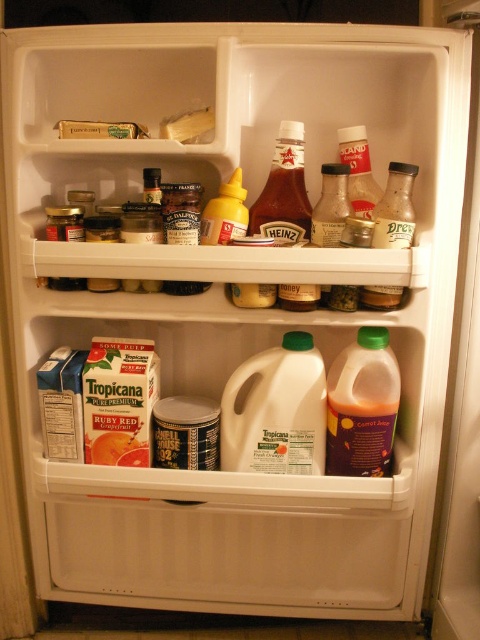
Question: From the image, what is the correct spatial relationship of white plastic jug at center in relation to translucent plastic dressing bottle at upper right?

Choices:
 (A) below
 (B) above

Answer: (A)

Question: Is translucent plastic carrot juice at lower center wider than yellow glossy mustard at upper center?

Choices:
 (A) no
 (B) yes

Answer: (B)

Question: Which object appears farthest from the camera in this image?

Choices:
 (A) white plastic jug at center
 (B) translucent plastic carrot juice at lower center

Answer: (A)

Question: Can you confirm if white plastic jug at center is wider than yellow glossy mustard at upper center?

Choices:
 (A) no
 (B) yes

Answer: (B)

Question: Which of these objects is positioned farthest from the yellow glossy mustard at upper center?

Choices:
 (A) white plastic jug at center
 (B) translucent plastic dressing bottle at upper right
 (C) translucent plastic carrot juice at lower center

Answer: (C)

Question: Which point is closer to the camera?

Choices:
 (A) yellow glossy mustard at upper center
 (B) white plastic jug at center
 (C) translucent plastic dressing bottle at upper right

Answer: (C)